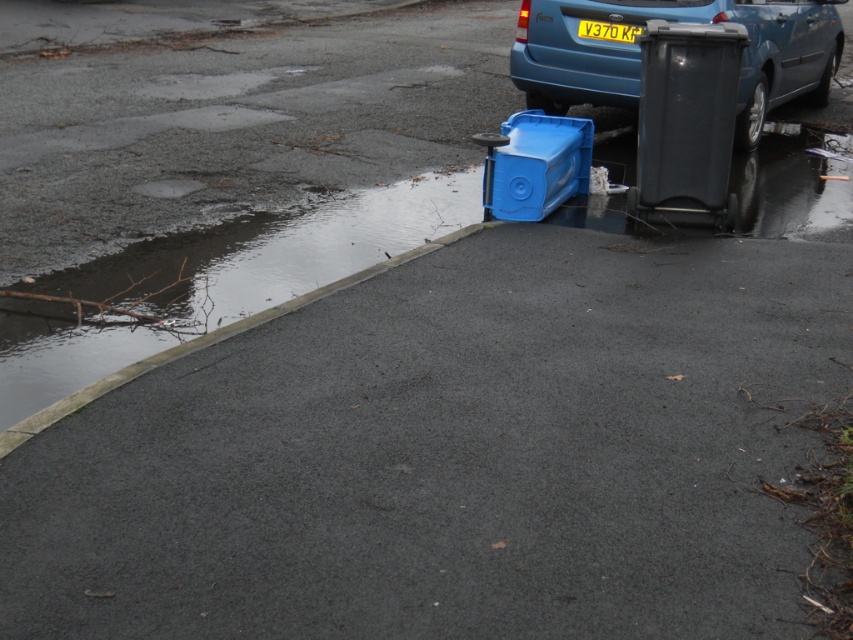
Image resolution: width=853 pixels, height=640 pixels. What do you see at coordinates (675, 20) in the screenshot?
I see `matte blue car at upper right` at bounding box center [675, 20].

Is point (564, 97) positioned in front of point (595, 29)?

No, it is behind (595, 29).

This screenshot has width=853, height=640. I want to click on matte blue car at upper right, so click(x=675, y=20).

Between black plastic trash can at right and blue plastic cooler at lower right, which one appears on the right side from the viewer's perspective?

black plastic trash can at right

Measure the distance between black plastic trash can at right and blue plastic cooler at lower right.

black plastic trash can at right and blue plastic cooler at lower right are 30.58 inches apart from each other.

Between point (705, 120) and point (575, 186), which one is positioned behind?

Point (575, 186)

The height and width of the screenshot is (640, 853). In order to click on black plastic trash can at right in this screenshot , I will do `click(686, 122)`.

Which of these two, matte blue car at upper right or black plastic trash can at right, stands taller?

With more height is matte blue car at upper right.

Is matte blue car at upper right to the left of black plastic trash can at right from the viewer's perspective?

Incorrect, matte blue car at upper right is not on the left side of black plastic trash can at right.

What do you see at coordinates (675, 20) in the screenshot?
I see `matte blue car at upper right` at bounding box center [675, 20].

Locate an element on the screen. matte blue car at upper right is located at coordinates [675, 20].